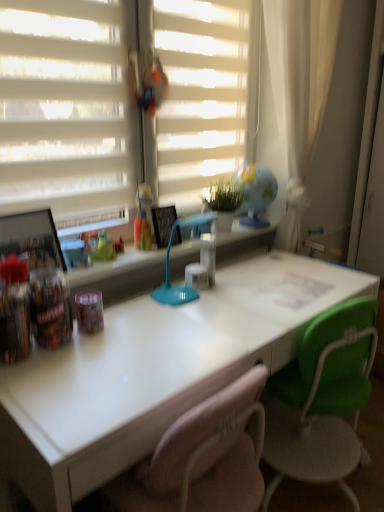
Image resolution: width=384 pixels, height=512 pixels. What are the coordinates of `vacant region below blue plastic table lamp at center (from a real-world perspective)` in the screenshot? It's located at (191, 305).